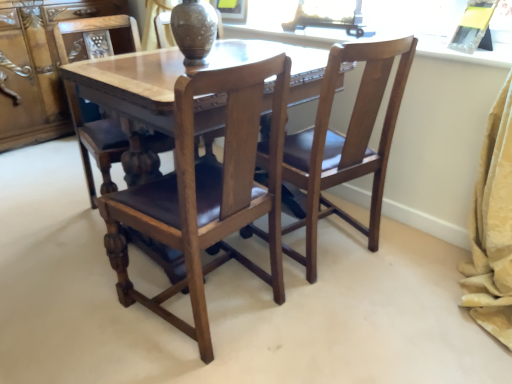
Locate an element on the screen. This screenshot has width=512, height=384. free spot to the right of polished wood chair at center, the 2th chair when ordered from right to left is located at coordinates (344, 318).